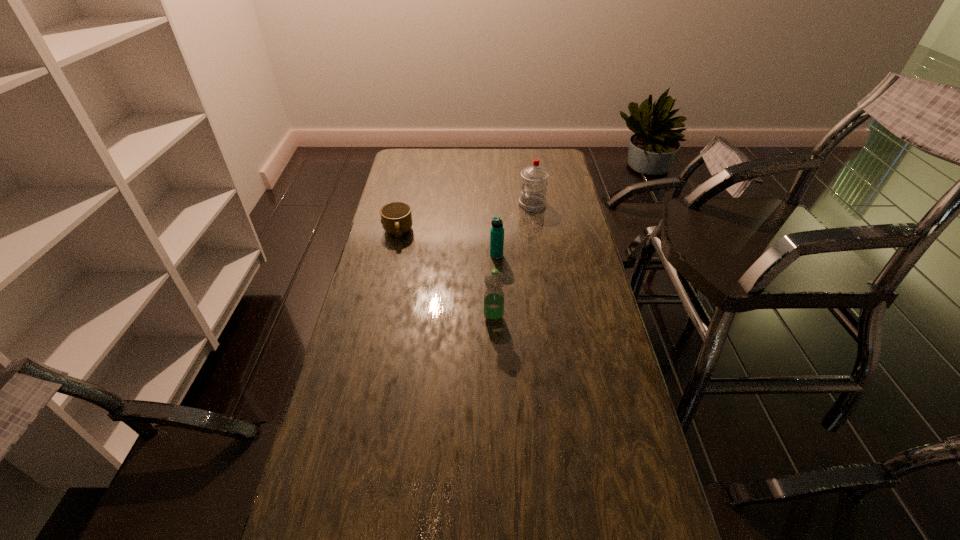
This screenshot has height=540, width=960. Find the location of `the farthest object`. the farthest object is located at coordinates (534, 178).

The width and height of the screenshot is (960, 540). Identify the location of the rightmost water bottle. (534, 178).

This screenshot has height=540, width=960. I want to click on the nearest object, so click(x=494, y=280).

Identify the location of the third farthest object. (497, 231).

At what (x,y) coordinates should I click in order to perform the action: click on the third tallest object. Please return your answer as a coordinate pair (x, y). This screenshot has width=960, height=540. Looking at the image, I should click on (497, 231).

At what (x,y) coordinates should I click in order to perform the action: click on mug. Please return your answer as a coordinate pair (x, y). This screenshot has width=960, height=540. Looking at the image, I should click on (396, 218).

Where is `the shortest object`? This screenshot has height=540, width=960. the shortest object is located at coordinates (396, 218).

At what (x,y) coordinates should I click in order to perform the action: click on vacant space located on the handle side of the farthest water bottle. Please return your answer as a coordinate pair (x, y). Looking at the image, I should click on (489, 204).

Identify the location of free spot located 0.400m on the handle side of the farthest water bottle. Image resolution: width=960 pixels, height=540 pixels. (425, 204).

Find the location of a particular element. This screenshot has width=960, height=540. vacant area situated 0.270m on the handle side of the farthest water bottle is located at coordinates 455,204.